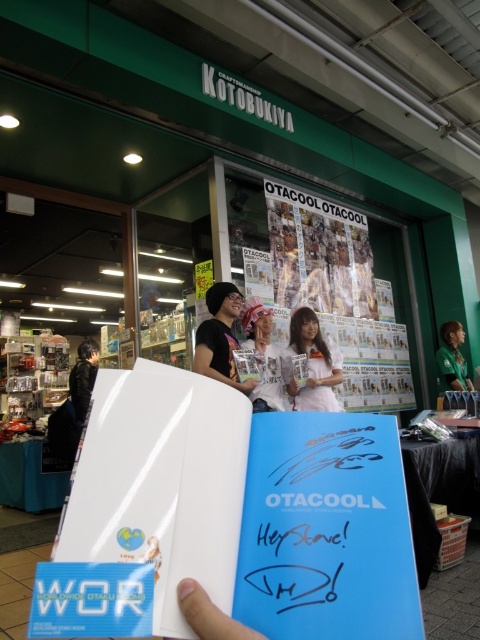
Question: Which object is farther from the camera taking this photo?

Choices:
 (A) white glossy book at center
 (B) blue matte book at center

Answer: (B)

Question: Does blue paper at center lie behind black leather jacket at left?

Choices:
 (A) yes
 (B) no

Answer: (B)

Question: Can you confirm if white paperboard at center is wider than green fabric shirt at right?

Choices:
 (A) yes
 (B) no

Answer: (A)

Question: Which object is closer to the camera taking this photo?

Choices:
 (A) white paperboard at center
 (B) white glossy book at center
 (C) matte black shirt at center
 (D) green fabric shirt at right

Answer: (B)

Question: Which point appears farthest from the camera in this image?

Choices:
 (A) (213, 612)
 (B) (280, 372)

Answer: (B)

Question: Does blue paper at center appear on the right side of blue matte book at center?

Choices:
 (A) no
 (B) yes

Answer: (A)